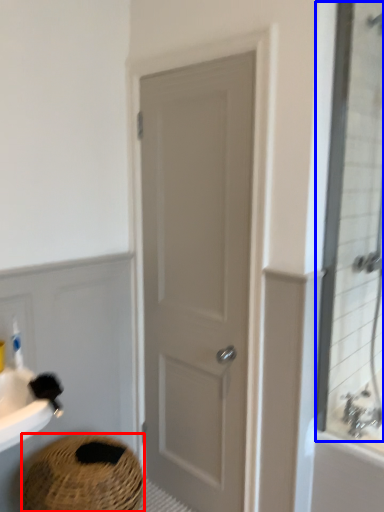
Question: Which of the following is the closest to the observer, basket (highlighted by a red box) or mirror (highlighted by a blue box)?

Choices:
 (A) basket
 (B) mirror

Answer: (B)